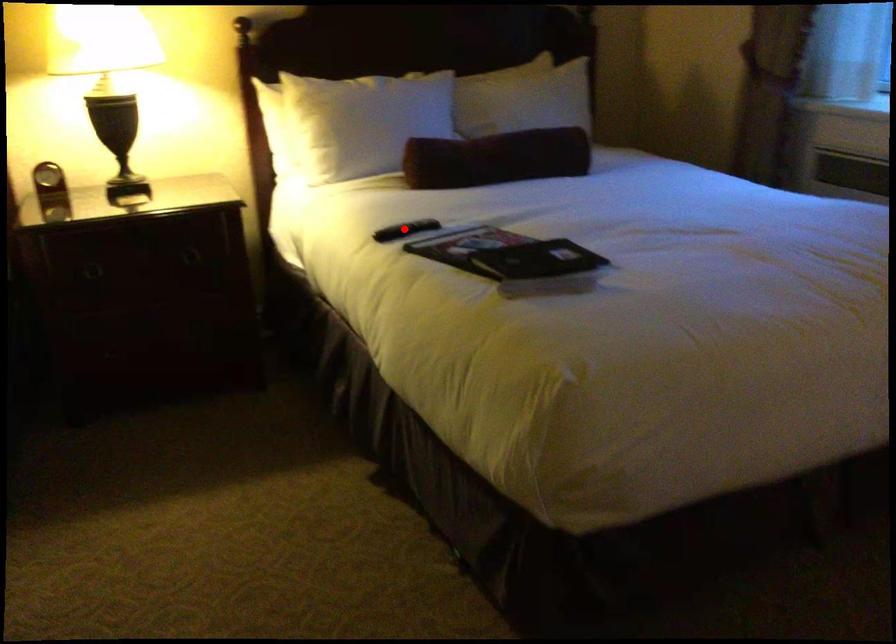
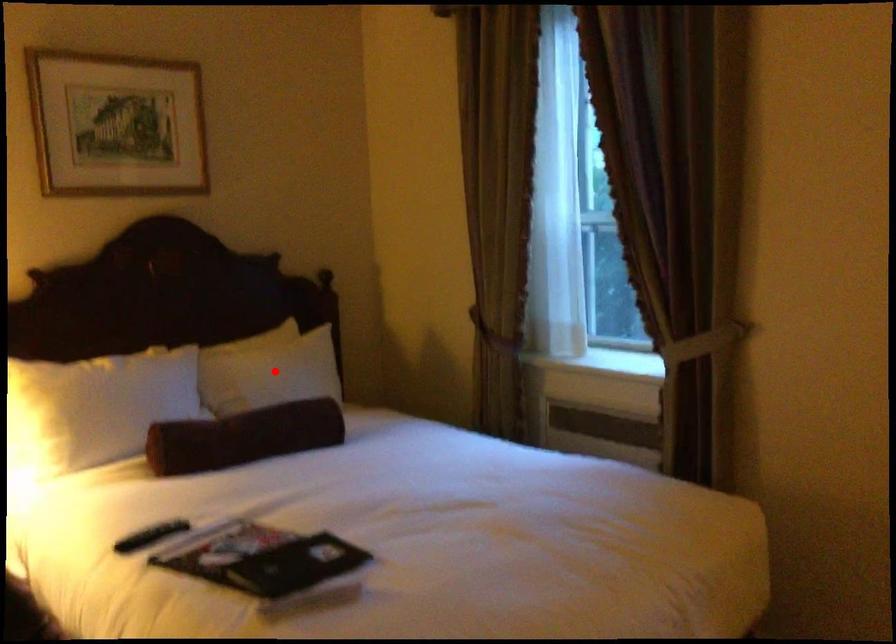
I am providing you with two images of the same scene from different viewpoints. A red point is marked on the first image and another point is marked on the second image. Does the point marked in image1 correspond to the same location as the one in image2?

No